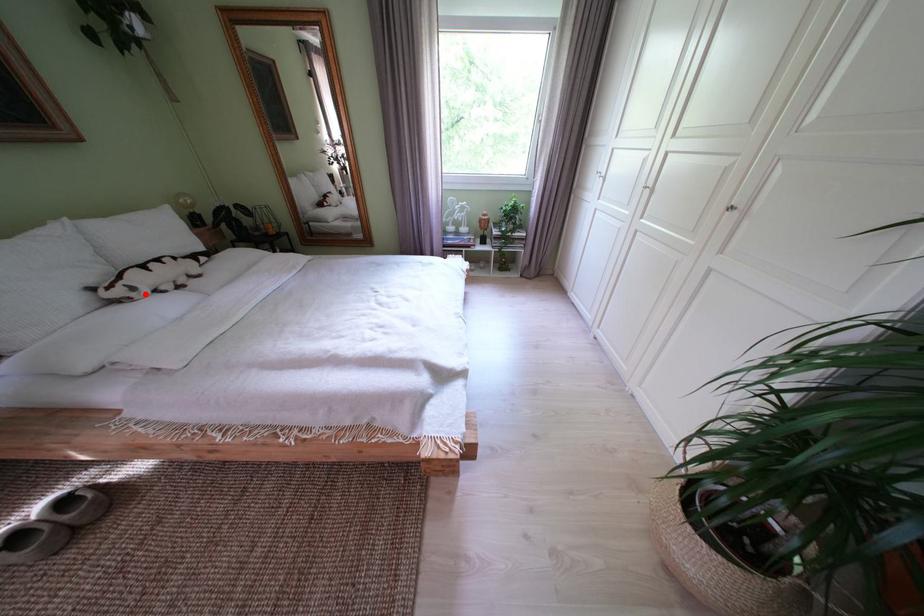
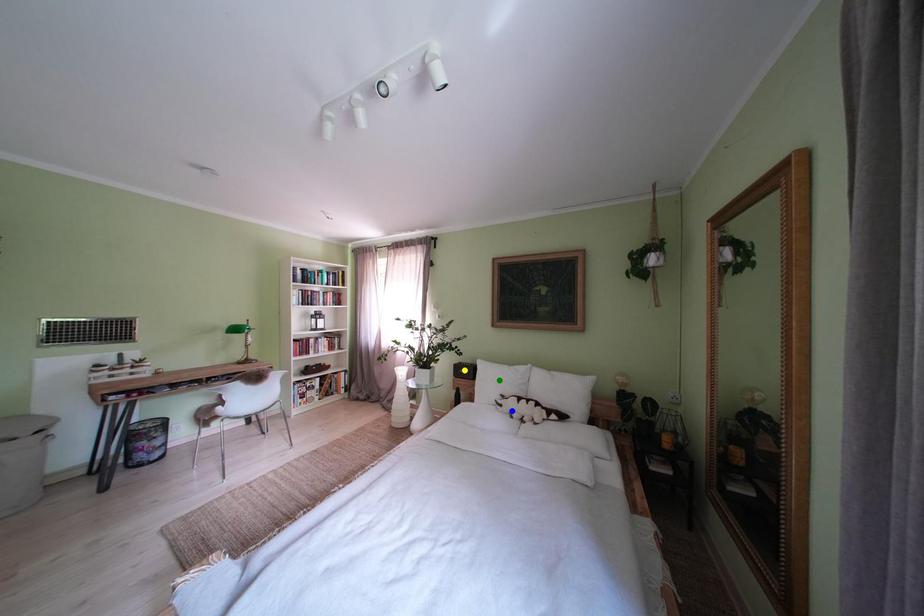
Question: I am providing you with two images of the same scene from different viewpoints. A red point is marked on the first image. You are given multiple points on the second image. Which spot in image 2 lines up with the point in image 1?

Choices:
 (A) green point
 (B) blue point
 (C) yellow point

Answer: (B)